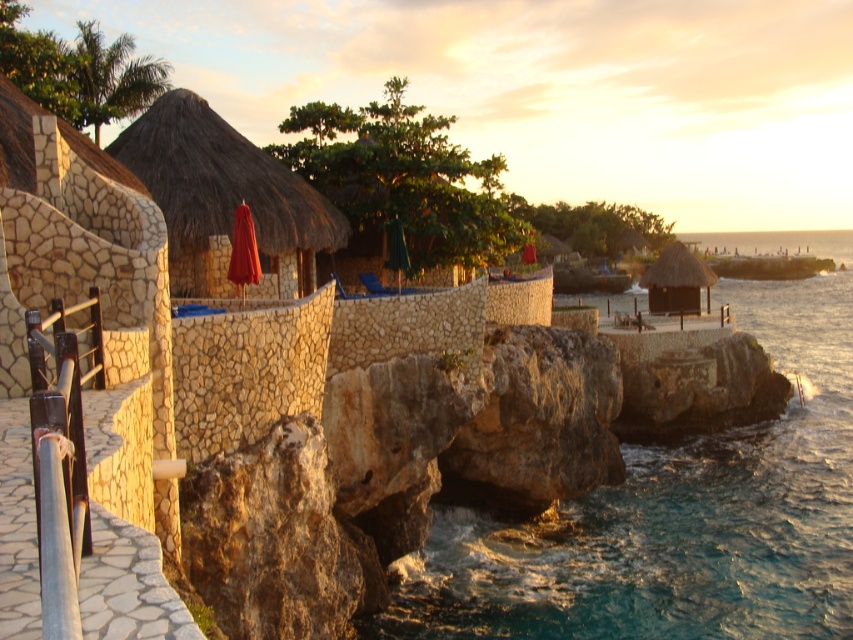
You are a guest at the resort and want to choose an umbrella to sit under for shade. The matte red umbrella at center and the green fabric umbrella at center are both available. Which one provides more coverage area?

The matte red umbrella at center has a greater width than the green fabric umbrella at center, so it provides a larger coverage area for shade.